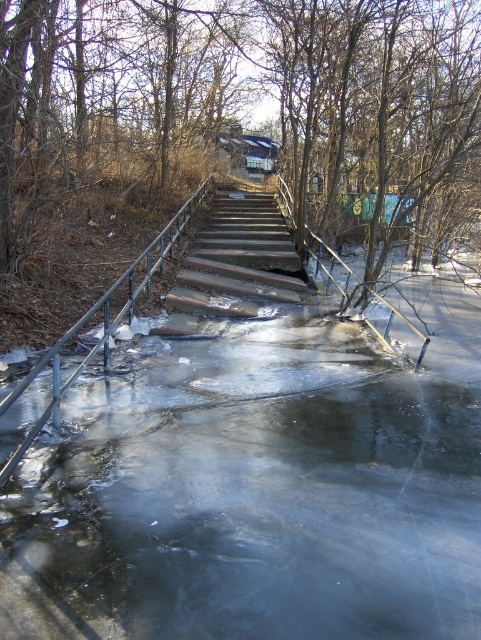
You are standing at the bottom of the stairs and want to reach the top. There are two points marked on the stairs. Which point is closer to you, point (187, 268) or point (116, 305)?

Point (116, 305) is closer to you because it is nearer to the camera compared to point (187, 268), which is further away.

From the picture: You are standing at the point with coordinates point [405,436] and want to walk towards the point with coordinates point [325,164]. Given the scene described, what potential obstacle might you encounter along the way?

The path between point [405,436] and point [325,164] may have flooded stairs and icy ground, which could pose slipping hazards due to the wet and icy conditions mentioned in the scene.